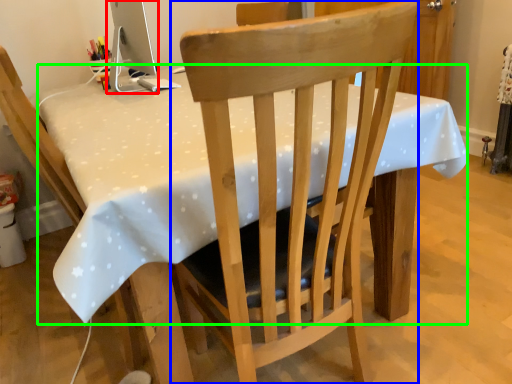
Question: Based on their relative distances, which object is farther from computer monitor (highlighted by a red box)? Choose from chair (highlighted by a blue box) and table (highlighted by a green box).

Choices:
 (A) chair
 (B) table

Answer: (A)